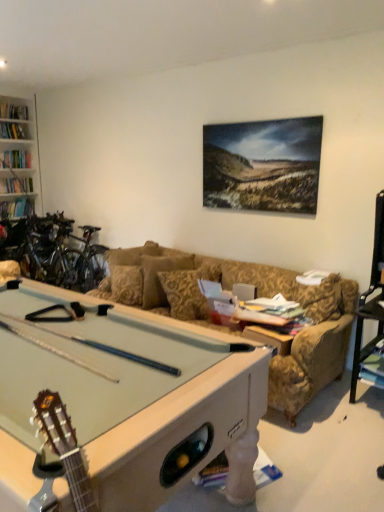
Locate an element on the screen. light green felt pool table at lower left is located at coordinates (123, 401).

Where is `shiny metallic bicycles at left`? shiny metallic bicycles at left is located at coordinates (56, 252).

Image resolution: width=384 pixels, height=512 pixels. I want to click on light green felt pool table at lower left, so click(123, 401).

Is light green felt pool table at lower left wider or thinner than shiny metallic bicycles at left?

light green felt pool table at lower left is wider than shiny metallic bicycles at left.

Is light green felt pool table at lower left smaller than shiny metallic bicycles at left?

Correct, light green felt pool table at lower left occupies less space than shiny metallic bicycles at left.

From the image's perspective, does shiny metallic bicycles at left appear higher than gold floral-patterned pillow at center?

Indeed, from the image's perspective, shiny metallic bicycles at left is shown above gold floral-patterned pillow at center.

Can you confirm if shiny metallic bicycles at left is shorter than gold floral-patterned pillow at center?

Incorrect, the height of shiny metallic bicycles at left does not fall short of that of gold floral-patterned pillow at center.

Can you confirm if shiny metallic bicycles at left is bigger than gold floral-patterned pillow at center?

Yes.

Consider the image. Is gold floral-patterned pillow at center at the back of shiny metallic bicycles at left?

No, gold floral-patterned pillow at center is not at the back of shiny metallic bicycles at left.

Considering the sizes of objects gold floral-patterned pillow at center and light green felt pool table at lower left in the image provided, who is smaller, gold floral-patterned pillow at center or light green felt pool table at lower left?

gold floral-patterned pillow at center.

Is point (180, 270) closer to camera compared to point (95, 366)?

No, (180, 270) is behind (95, 366).

Which object is thinner, gold floral-patterned pillow at center or light green felt pool table at lower left?

Thinner between the two is gold floral-patterned pillow at center.

Is shiny metallic bicycles at left placed right next to light green felt pool table at lower left?

No, shiny metallic bicycles at left is not touching light green felt pool table at lower left.

Is the depth of shiny metallic bicycles at left greater than that of light green felt pool table at lower left?

That is True.

In terms of width, does shiny metallic bicycles at left look wider or thinner when compared to light green felt pool table at lower left?

Clearly, shiny metallic bicycles at left has less width compared to light green felt pool table at lower left.

From a real-world perspective, who is located lower, shiny metallic bicycles at left or light green felt pool table at lower left?

light green felt pool table at lower left is physically lower.

Is gold floral-patterned pillow at center smaller than shiny metallic bicycles at left?

Yes.

In the image, is gold floral-patterned pillow at center positioned in front of or behind shiny metallic bicycles at left?

gold floral-patterned pillow at center is in front of shiny metallic bicycles at left.

Is gold floral-patterned pillow at center taller than shiny metallic bicycles at left?

No.

Between gold floral-patterned pillow at center and shiny metallic bicycles at left, which one appears on the left side from the viewer's perspective?

shiny metallic bicycles at left is more to the left.

Is light green felt pool table at lower left positioned in front of gold floral-patterned pillow at center?

Yes, light green felt pool table at lower left is closer to the viewer.

From a real-world perspective, who is located higher, light green felt pool table at lower left or gold floral-patterned pillow at center?

gold floral-patterned pillow at center is physically above.

Which is less distant, (26, 349) or (172, 285)?

Point (26, 349) is positioned closer to the camera compared to point (172, 285).

Between light green felt pool table at lower left and gold floral-patterned pillow at center, which one has larger width?

light green felt pool table at lower left.

Find the location of a particular element. billiard table lying below the shiny metallic bicycles at left (from the image's perspective) is located at coordinates (123, 401).

Find the location of a particular element. The image size is (384, 512). bicycle on the left of gold floral-patterned pillow at center is located at coordinates coord(56,252).

Which object lies further to the anchor point light green felt pool table at lower left, shiny metallic bicycles at left or gold floral-patterned pillow at center?

shiny metallic bicycles at left is further to light green felt pool table at lower left.

Considering their positions, is gold floral-patterned pillow at center positioned closer to shiny metallic bicycles at left than light green felt pool table at lower left?

gold floral-patterned pillow at center is positioned closer to the anchor shiny metallic bicycles at left.

In the scene shown: From the image, which object appears to be nearer to light green felt pool table at lower left, gold floral-patterned pillow at center or shiny metallic bicycles at left?

gold floral-patterned pillow at center is closer to light green felt pool table at lower left.

Based on their spatial positions, is shiny metallic bicycles at left or light green felt pool table at lower left closer to gold floral-patterned pillow at center?

Among the two, light green felt pool table at lower left is located nearer to gold floral-patterned pillow at center.

In the scene shown: From the image, which object appears to be nearer to shiny metallic bicycles at left, light green felt pool table at lower left or gold floral-patterned pillow at center?

Based on the image, gold floral-patterned pillow at center appears to be nearer to shiny metallic bicycles at left.

From the image, which object appears to be nearer to gold floral-patterned pillow at center, light green felt pool table at lower left or shiny metallic bicycles at left?

The object closer to gold floral-patterned pillow at center is light green felt pool table at lower left.

The height and width of the screenshot is (512, 384). In order to click on pillow between light green felt pool table at lower left and shiny metallic bicycles at left along the z-axis in this screenshot , I will do `click(188, 291)`.